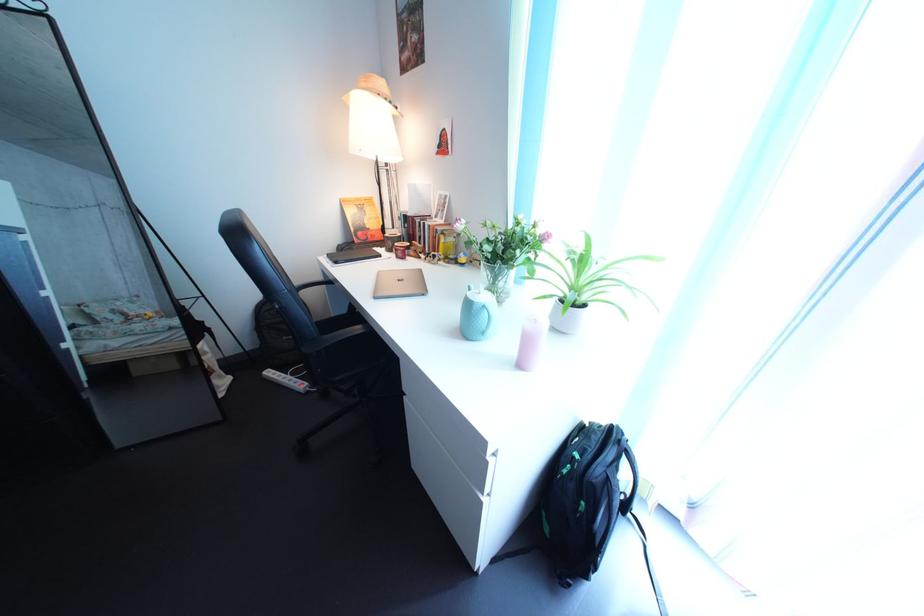
Where is `chair sitting surface`? This screenshot has width=924, height=616. chair sitting surface is located at coordinates (362, 344).